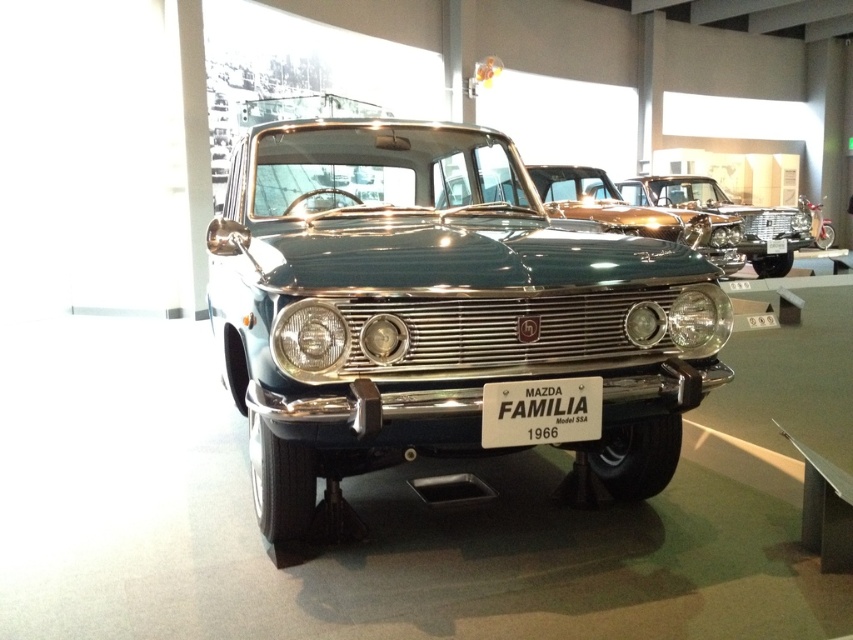
You are a museum curator arranging a display for the Mazda Familia Model SSA. You need to ensure that the white plastic license plate at center and the clear glass headlight at center are visible to visitors. Considering their sizes, which object will occupy more horizontal space on the car?

The white plastic license plate at center has a greater width than the clear glass headlight at center, so it will occupy more horizontal space on the car.

You are a museum guide explaining the 1966 Mazda Familia Model SSA to visitors. You point out the shiny metallic car at center and the matte chrome headlight at center. Which object would you describe as being bigger in size?

The shiny metallic car at center is larger in size than the matte chrome headlight at center.

You are standing in a museum and see the metallic teal car at center. If you face the front of the car, which direction would you be facing relative to your current position?

Since the metallic teal car at center is positioned centrally in the frame with its front facing the viewer, you would be facing the same direction as the car if you face its front. However, the question asks for the direction relative to your current position. Since the car is facing directly towards you, facing its front would mean you are facing towards the car, which is straight ahead. Therefore, you would be facing forward relative to your current position.